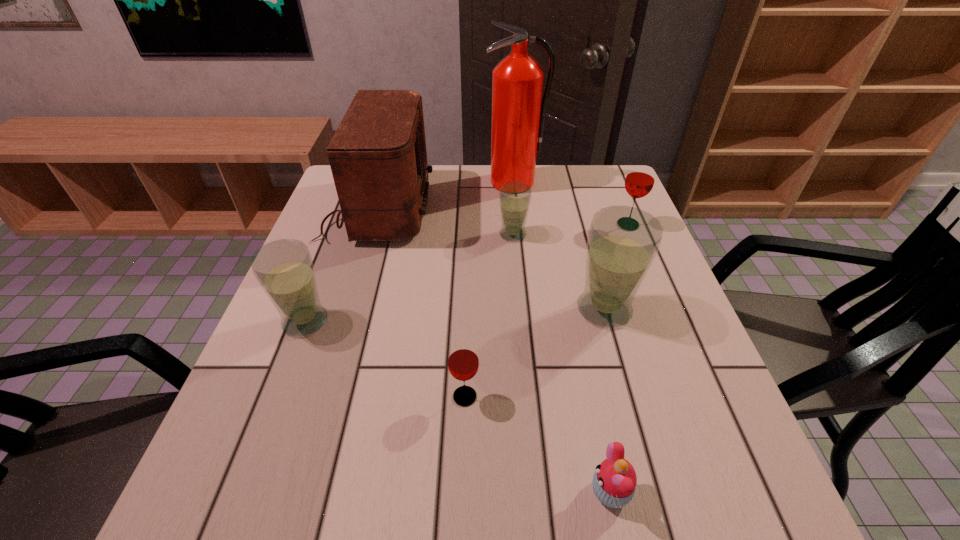
Where is `free space between the rightmost glass and the second biggest blue glass`? This screenshot has height=540, width=960. free space between the rightmost glass and the second biggest blue glass is located at coordinates (467, 273).

The image size is (960, 540). I want to click on vacant area that lies between the leftmost blue glass and the farther red glass, so click(x=467, y=273).

Locate an element on the screen. The height and width of the screenshot is (540, 960). vacant space that is in between the smaller red glass and the cupcake is located at coordinates (538, 444).

The height and width of the screenshot is (540, 960). I want to click on free space between the bigger red glass and the second biggest blue glass, so click(x=467, y=273).

You are a GUI agent. You are given a task and a screenshot of the screen. Output one action in this format:
    pyautogui.click(x=<x>, y=<y>)
    Task: Click on the vacant region between the tallest glass and the smaller red glass
    The image size is (960, 540).
    Given the screenshot: What is the action you would take?
    pyautogui.click(x=535, y=353)

Identify which object is located as the seventh nearest to the rightmost blue glass. Please provide its 2D coordinates. Your answer should be formatted as a tuple, i.e. [(x, y)], where the tuple contains the x and y coordinates of a point satisfying the conditions above.

[(284, 269)]

Find the location of a particular element. The width and height of the screenshot is (960, 540). object that ranks as the second closest to the shortest object is located at coordinates (623, 241).

Choose which glass is the nearest neighbor to the tallest object. Please provide its 2D coordinates. Your answer should be formatted as a tuple, i.e. [(x, y)], where the tuple contains the x and y coordinates of a point satisfying the conditions above.

[(514, 197)]

I want to click on glass that is the fourth nearest to the third object from left to right, so click(x=640, y=179).

Identify which blue glass is the nearest to the biggest blue glass. Please provide its 2D coordinates. Your answer should be formatted as a tuple, i.e. [(x, y)], where the tuple contains the x and y coordinates of a point satisfying the conditions above.

[(514, 197)]